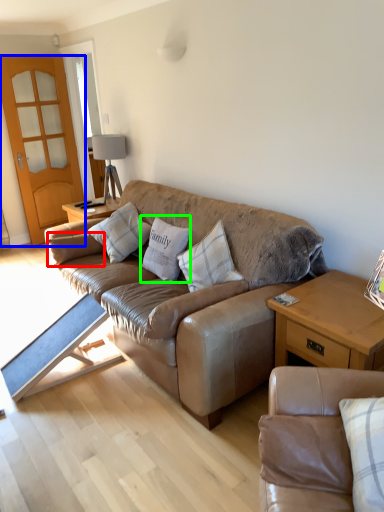
Question: Estimate the real-world distances between objects in this image. Which object is closer to pillow (highlighted by a red box), screen door (highlighted by a blue box) or pillow (highlighted by a green box)?

Choices:
 (A) screen door
 (B) pillow

Answer: (B)